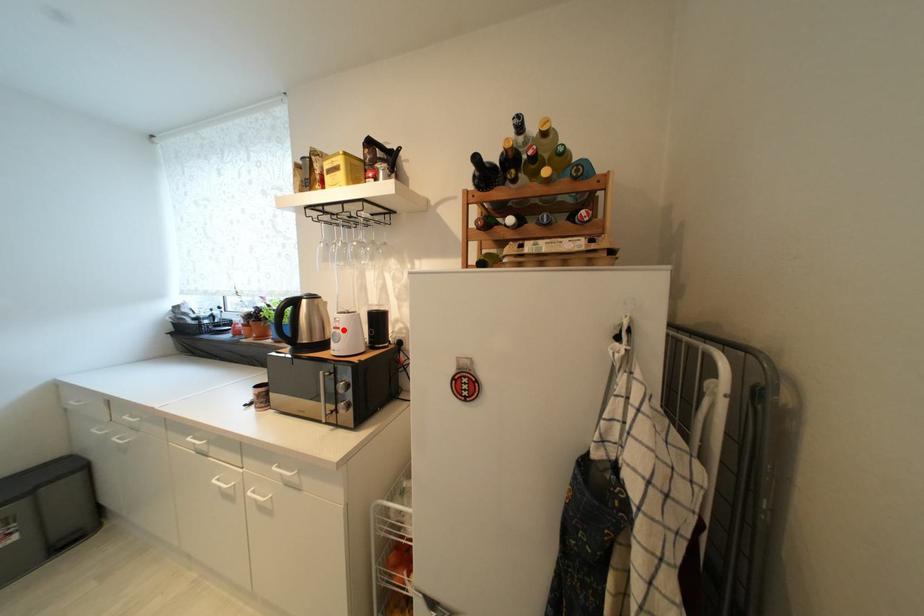
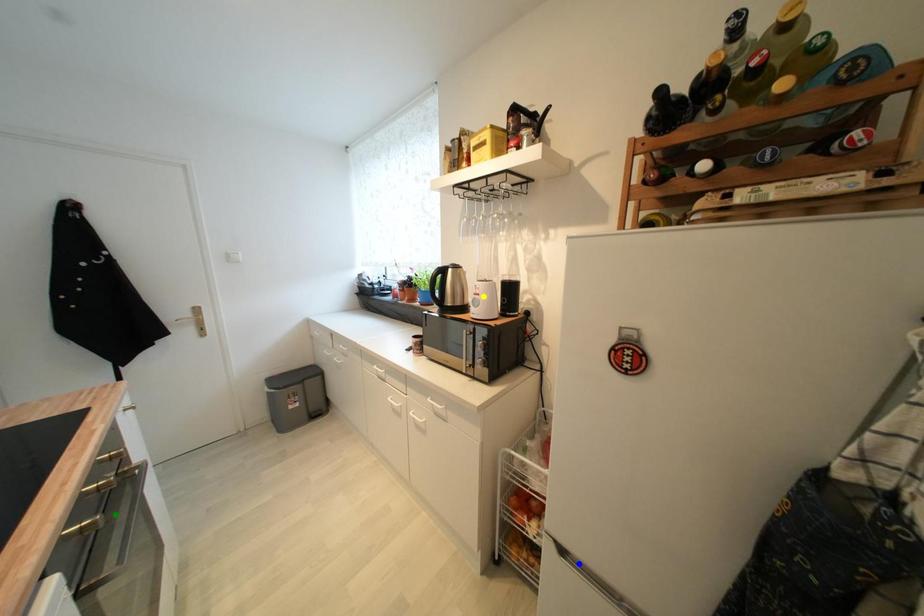
Question: I am providing you with two images of the same scene from different viewpoints. A red point is marked on the first image. You are given multiple points on the second image. In image 2, which mark is for the same physical point as the one in image 1?

Choices:
 (A) green point
 (B) blue point
 (C) yellow point

Answer: (C)